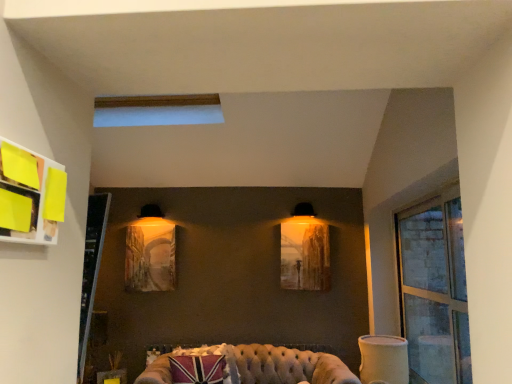
Measure the distance between point (414, 291) and camera.

3.75 meters.

Describe the element at coordinates (434, 289) in the screenshot. The height and width of the screenshot is (384, 512). I see `transparent glass window at right` at that location.

Describe the element at coordinates (305, 256) in the screenshot. I see `matte glass picture frame at center, which appears as the 2th picture frame when viewed from the left` at that location.

What do you see at coordinates (150, 255) in the screenshot? I see `matte wooden picture frame at center, the 2th picture frame viewed from the right` at bounding box center [150, 255].

Where is `transparent glass window at right`? Image resolution: width=512 pixels, height=384 pixels. transparent glass window at right is located at coordinates (434, 289).

Is transparent glass window at right not near tufted leather couch at lower center?

transparent glass window at right is far away from tufted leather couch at lower center.

Considering the relative positions of transparent glass window at right and tufted leather couch at lower center in the image provided, is transparent glass window at right to the right of tufted leather couch at lower center from the viewer's perspective?

Yes.

Is transparent glass window at right in front of or behind tufted leather couch at lower center in the image?

transparent glass window at right is positioned closer to the viewer than tufted leather couch at lower center.

Does transparent glass window at right have a smaller size compared to tufted leather couch at lower center?

Indeed, transparent glass window at right has a smaller size compared to tufted leather couch at lower center.

From a real-world perspective, does yellow paper at upper left sit lower than transparent glass window at right?

No.

Find the location of `window behind the yellow paper at upper left`. window behind the yellow paper at upper left is located at coordinates 434,289.

Is yellow paper at upper left far away from transparent glass window at right?

yellow paper at upper left is positioned a significant distance from transparent glass window at right.

What's the angular difference between yellow paper at upper left and transparent glass window at right's facing directions?

The facing directions of yellow paper at upper left and transparent glass window at right are 178 degrees apart.

Is matte wooden picture frame at center, which is the first picture frame in left-to-right order, not inside yellow paper at upper left?

That's correct, matte wooden picture frame at center, which is the first picture frame in left-to-right order, is outside of yellow paper at upper left.

Which object is wider, matte wooden picture frame at center, which is the first picture frame in left-to-right order, or yellow paper at upper left?

Wider between the two is yellow paper at upper left.

Between matte wooden picture frame at center, which is the first picture frame in left-to-right order, and yellow paper at upper left, which one has less height?

yellow paper at upper left is shorter.

Which is farther from the camera, (167, 259) or (42, 186)?

The point (167, 259) is farther from the camera.

Between matte glass picture frame at center, the first picture frame positioned from the right, and yellow paper at upper left, which one is positioned behind?

Positioned behind is matte glass picture frame at center, the first picture frame positioned from the right.

From a real-world perspective, is matte glass picture frame at center, which appears as the 2th picture frame when viewed from the left, physically located above or below yellow paper at upper left?

matte glass picture frame at center, which appears as the 2th picture frame when viewed from the left, is below yellow paper at upper left.

From the image's perspective, is matte glass picture frame at center, the first picture frame positioned from the right, beneath yellow paper at upper left?

Yes.

Measure the distance from matte glass picture frame at center, which appears as the 2th picture frame when viewed from the left, to yellow paper at upper left.

matte glass picture frame at center, which appears as the 2th picture frame when viewed from the left, is 3.10 meters from yellow paper at upper left.

From the image's perspective, is tufted leather couch at lower center positioned above or below yellow paper at upper left?

From the image's perspective, tufted leather couch at lower center appears below yellow paper at upper left.

Does point (194, 367) lie in front of point (16, 191)?

No.

From a real-world perspective, which is physically below, tufted leather couch at lower center or yellow paper at upper left?

tufted leather couch at lower center, from a real-world perspective.

In the scene shown: How distant is tufted leather couch at lower center from yellow paper at upper left?

tufted leather couch at lower center is 2.55 meters from yellow paper at upper left.

From a real-world perspective, is matte wooden picture frame at center, which is the first picture frame in left-to-right order, physically located above or below tufted leather couch at lower center?

In terms of real-world spatial position, matte wooden picture frame at center, which is the first picture frame in left-to-right order, is above tufted leather couch at lower center.

Does matte wooden picture frame at center, the 2th picture frame viewed from the right, turn towards tufted leather couch at lower center?

No, matte wooden picture frame at center, the 2th picture frame viewed from the right, is not oriented towards tufted leather couch at lower center.

Would you say tufted leather couch at lower center is part of matte wooden picture frame at center, the 2th picture frame viewed from the right,'s contents?

No, tufted leather couch at lower center is located outside of matte wooden picture frame at center, the 2th picture frame viewed from the right.

Can you confirm if matte wooden picture frame at center, which is the first picture frame in left-to-right order, is positioned to the right of tufted leather couch at lower center?

No.

Considering the relative sizes of matte glass picture frame at center, which appears as the 2th picture frame when viewed from the left, and tufted leather couch at lower center in the image provided, is matte glass picture frame at center, which appears as the 2th picture frame when viewed from the left, bigger than tufted leather couch at lower center?

No.

Is matte glass picture frame at center, the first picture frame positioned from the right, located outside tufted leather couch at lower center?

Absolutely, matte glass picture frame at center, the first picture frame positioned from the right, is external to tufted leather couch at lower center.

Who is shorter, matte glass picture frame at center, the first picture frame positioned from the right, or tufted leather couch at lower center?

tufted leather couch at lower center is shorter.

In terms of width, does matte glass picture frame at center, the first picture frame positioned from the right, look wider or thinner when compared to tufted leather couch at lower center?

Considering their sizes, matte glass picture frame at center, the first picture frame positioned from the right, looks slimmer than tufted leather couch at lower center.

Find the location of `window positioned vertically above the tufted leather couch at lower center (from a real-world perspective)`. window positioned vertically above the tufted leather couch at lower center (from a real-world perspective) is located at coordinates (434, 289).

Where is `window that appears below the yellow paper at upper left (from the image's perspective)`? window that appears below the yellow paper at upper left (from the image's perspective) is located at coordinates (434, 289).

Which object lies further to the anchor point yellow paper at upper left, matte wooden picture frame at center, the 2th picture frame viewed from the right, or tufted leather couch at lower center?

The object further to yellow paper at upper left is matte wooden picture frame at center, the 2th picture frame viewed from the right.

Looking at the image, which one is located further to yellow paper at upper left, tufted leather couch at lower center or transparent glass window at right?

Among the two, tufted leather couch at lower center is located further to yellow paper at upper left.

When comparing their distances from matte wooden picture frame at center, the 2th picture frame viewed from the right, does transparent glass window at right or yellow paper at upper left seem closer?

transparent glass window at right.

Looking at the image, which one is located closer to matte glass picture frame at center, the first picture frame positioned from the right, yellow paper at upper left or transparent glass window at right?

transparent glass window at right is positioned closer to the anchor matte glass picture frame at center, the first picture frame positioned from the right.

Which object lies further to the anchor point yellow paper at upper left, transparent glass window at right or matte wooden picture frame at center, which is the first picture frame in left-to-right order?

The object further to yellow paper at upper left is matte wooden picture frame at center, which is the first picture frame in left-to-right order.

Considering their positions, is matte glass picture frame at center, the first picture frame positioned from the right, positioned further to matte wooden picture frame at center, the 2th picture frame viewed from the right, than transparent glass window at right?

Among the two, transparent glass window at right is located further to matte wooden picture frame at center, the 2th picture frame viewed from the right.

Considering their positions, is matte wooden picture frame at center, which is the first picture frame in left-to-right order, positioned further to transparent glass window at right than matte glass picture frame at center, which appears as the 2th picture frame when viewed from the left?

matte wooden picture frame at center, which is the first picture frame in left-to-right order, is positioned further to the anchor transparent glass window at right.

Estimate the real-world distances between objects in this image. Which object is closer to matte glass picture frame at center, which appears as the 2th picture frame when viewed from the left, yellow paper at upper left or matte wooden picture frame at center, the 2th picture frame viewed from the right?

matte wooden picture frame at center, the 2th picture frame viewed from the right, is positioned closer to the anchor matte glass picture frame at center, which appears as the 2th picture frame when viewed from the left.

The image size is (512, 384). Find the location of `window positioned between yellow paper at upper left and tufted leather couch at lower center from near to far`. window positioned between yellow paper at upper left and tufted leather couch at lower center from near to far is located at coordinates (434, 289).

Locate an element on the screen. window between yellow paper at upper left and matte glass picture frame at center, which appears as the 2th picture frame when viewed from the left, along the z-axis is located at coordinates (434, 289).

Locate an element on the screen. The width and height of the screenshot is (512, 384). studio couch positioned between yellow paper at upper left and matte glass picture frame at center, which appears as the 2th picture frame when viewed from the left, from near to far is located at coordinates (246, 366).

Where is `studio couch between yellow paper at upper left and matte wooden picture frame at center, the 2th picture frame viewed from the right, in the front-back direction`? studio couch between yellow paper at upper left and matte wooden picture frame at center, the 2th picture frame viewed from the right, in the front-back direction is located at coordinates (246, 366).